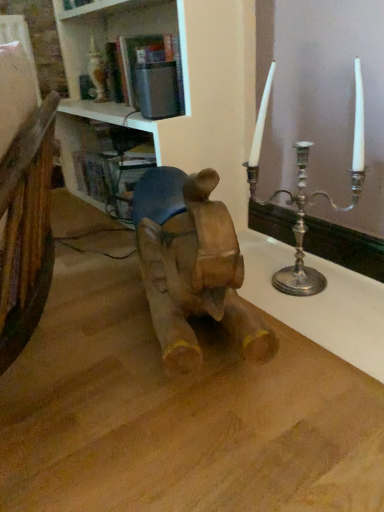
The image size is (384, 512). I want to click on free spot behind silver metallic candlestick at upper right, so click(x=268, y=250).